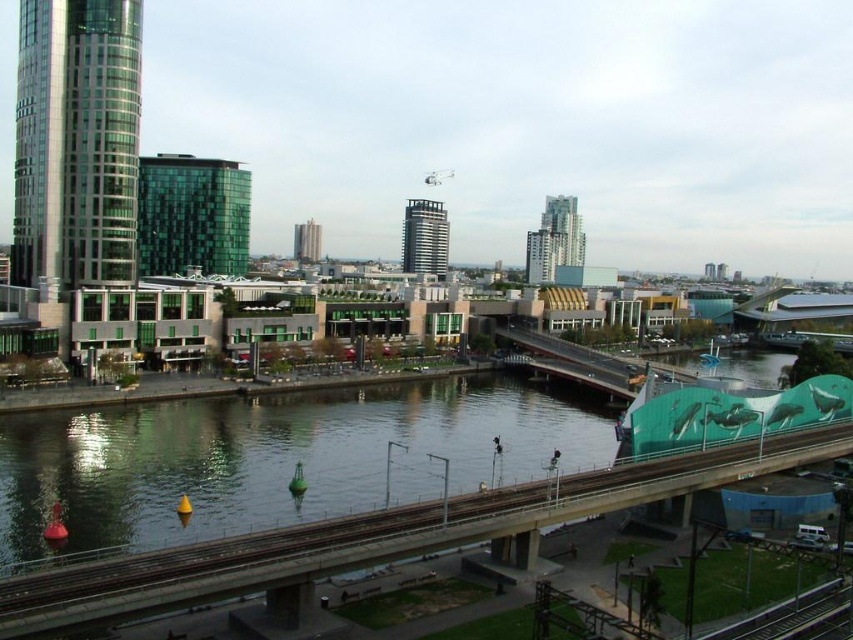
Question: Is glassy metallic skyscraper at left wider than green glass tower at center?

Choices:
 (A) no
 (B) yes

Answer: (B)

Question: Is green glass building at upper left thinner than green metallic train track at lower right?

Choices:
 (A) no
 (B) yes

Answer: (A)

Question: Which is nearer to the green glass tower at center?

Choices:
 (A) green metallic train track at lower right
 (B) metallic glass tower at center

Answer: (B)

Question: Is green glass building at upper left further to the viewer compared to glassy concrete skyscraper at center?

Choices:
 (A) yes
 (B) no

Answer: (B)

Question: Which object is the farthest from the metallic glass tower at center?

Choices:
 (A) glassy concrete skyscraper at center
 (B) green glass tower at center
 (C) green concrete bridge at center
 (D) clear water at center

Answer: (C)

Question: Based on their relative distances, which object is nearer to the green concrete bridge at center?

Choices:
 (A) metallic glass tower at center
 (B) glassy metallic skyscraper at left
 (C) green glass tower at center
 (D) green glass building at upper left

Answer: (B)